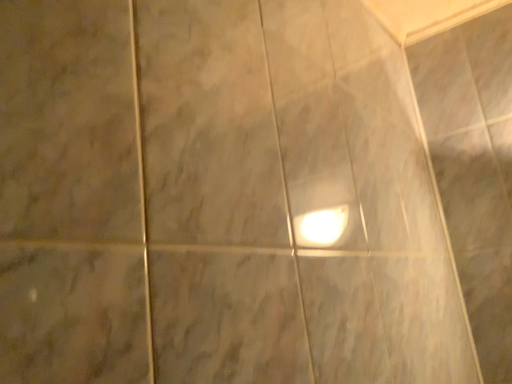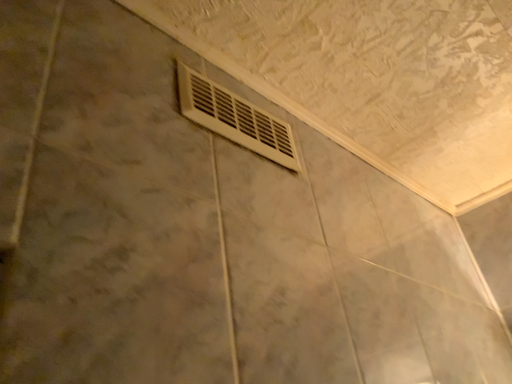
Question: Which way did the camera rotate in the video?

Choices:
 (A) rotated left
 (B) rotated right

Answer: (A)